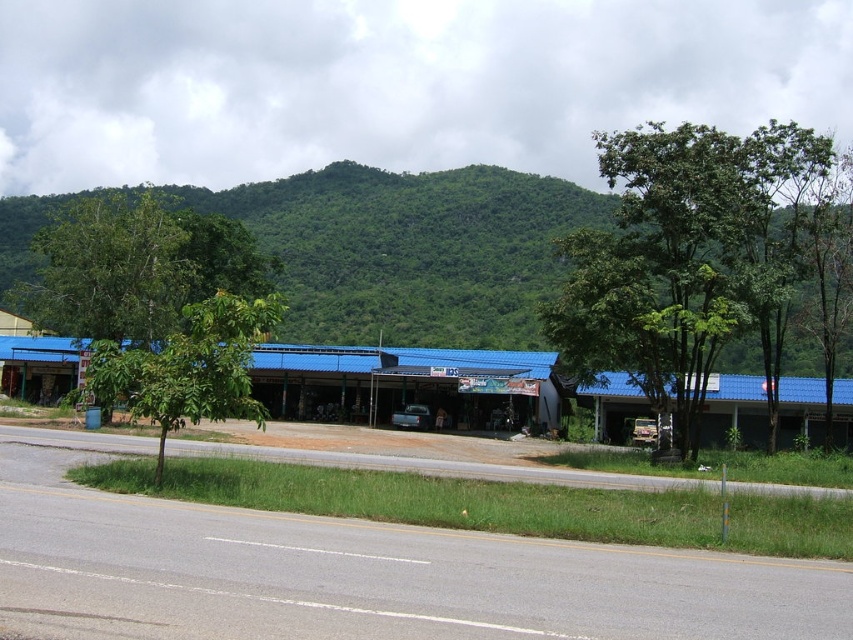
You are a driver approaching the green leafy mountain at upper center and the green leafy tree at center. Which object will appear closer to you as you look ahead?

The green leafy tree at center appears closer because it occupies more space than the green leafy mountain at upper center, which is smaller in the image.

You are standing on the road and see two points marked on the ground. The first point is at coordinate point (x=764, y=304) and the second is at point (x=173, y=337). If you want to walk towards the first point, which direction should you move relative to the second point?

To reach the first point (x=764, y=304) from the second point (x=173, y=337), you should move towards the north because the first point is behind the second point, indicating it is in the opposite direction of where you are facing.